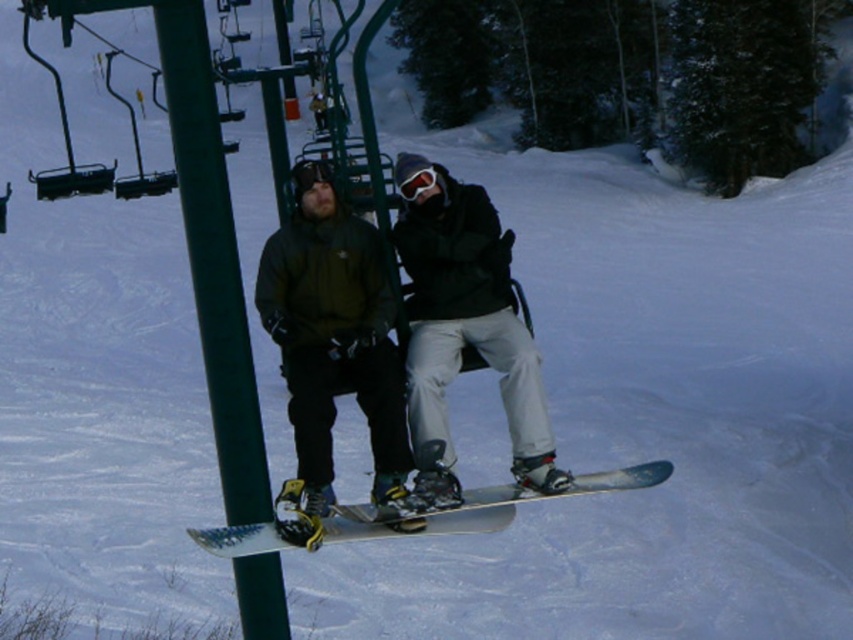
You are planning to carry both the matte black snowboard at center and the green metallic pole at left into a storage room that has a height limit of 1.2 meters. Based on their sizes, can both items fit vertically without exceeding the height limit?

The matte black snowboard at center is shorter than the green metallic pole at left. Since the pole is taller than the snowboard, but we don not know their exact heights, it is possible that the pole might exceed the 1.2 meter limit. Therefore, it is uncertain if both can fit without further information.

You are standing at the center of the ski lift chair and want to grab the green metallic pole at left. In which direction should you move to reach it?

The green metallic pole at left is located at point (213, 259), so you should move to your left to reach it.